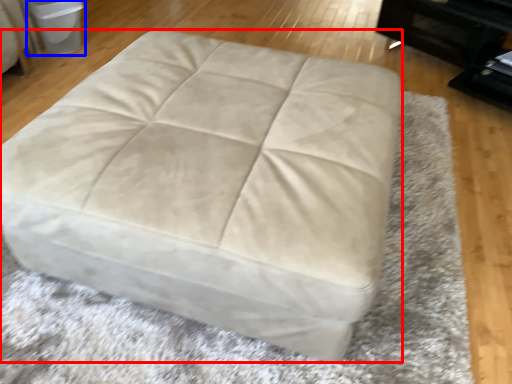
Question: Which object appears farthest to the camera in this image, furniture (highlighted by a red box) or bean bag chair (highlighted by a blue box)?

Choices:
 (A) furniture
 (B) bean bag chair

Answer: (B)